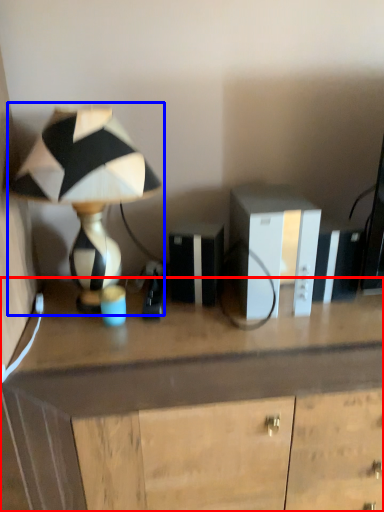
Question: Which object appears closest to the camera in this image, desk (highlighted by a red box) or lamp (highlighted by a blue box)?

Choices:
 (A) desk
 (B) lamp

Answer: (B)